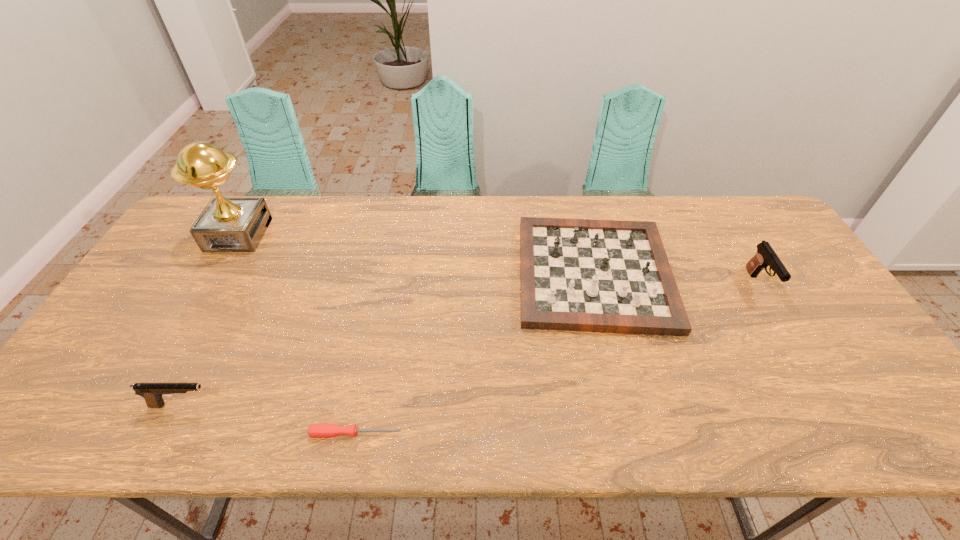
Image resolution: width=960 pixels, height=540 pixels. I want to click on vacant space that satisfies the following two spatial constraints: 1. on the front side of the chessboard; 2. at the tip of the nearest object, so click(x=634, y=433).